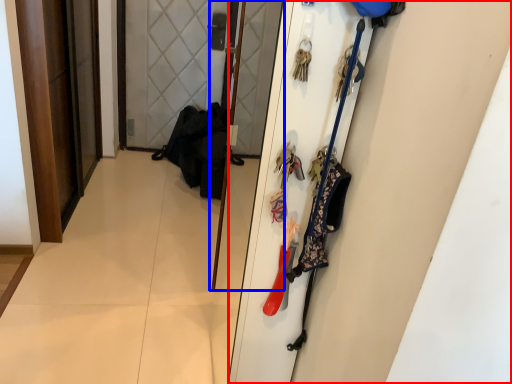
Question: Which of the following is the closest to the observer, door (highlighted by a red box) or screen door (highlighted by a blue box)?

Choices:
 (A) door
 (B) screen door

Answer: (A)